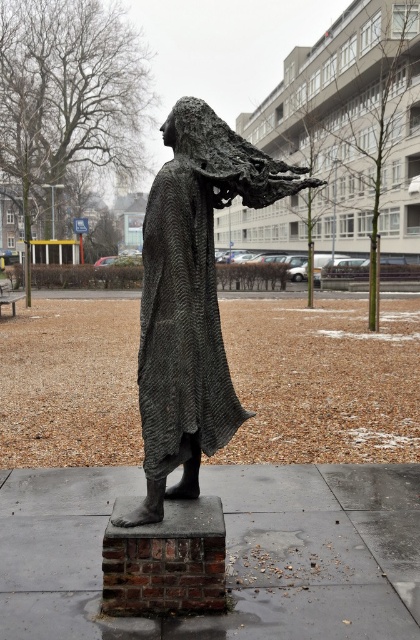
Which of these two, bronze textured statue at center or textured dark gray robe at center, stands taller?

With more height is bronze textured statue at center.

Can you confirm if bronze textured statue at center is smaller than textured dark gray robe at center?

Actually, bronze textured statue at center might be larger than textured dark gray robe at center.

Is point (146, 404) behind point (176, 180)?

Yes.

At what (x,y) coordinates should I click in order to perform the action: click on bronze textured statue at center. Please return your answer as a coordinate pair (x, y). Looking at the image, I should click on [x=191, y=298].